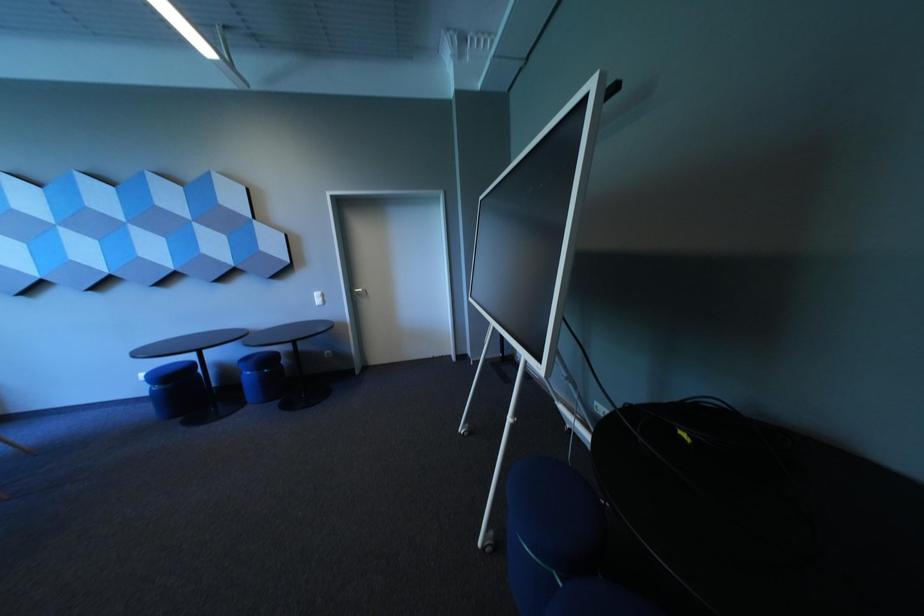
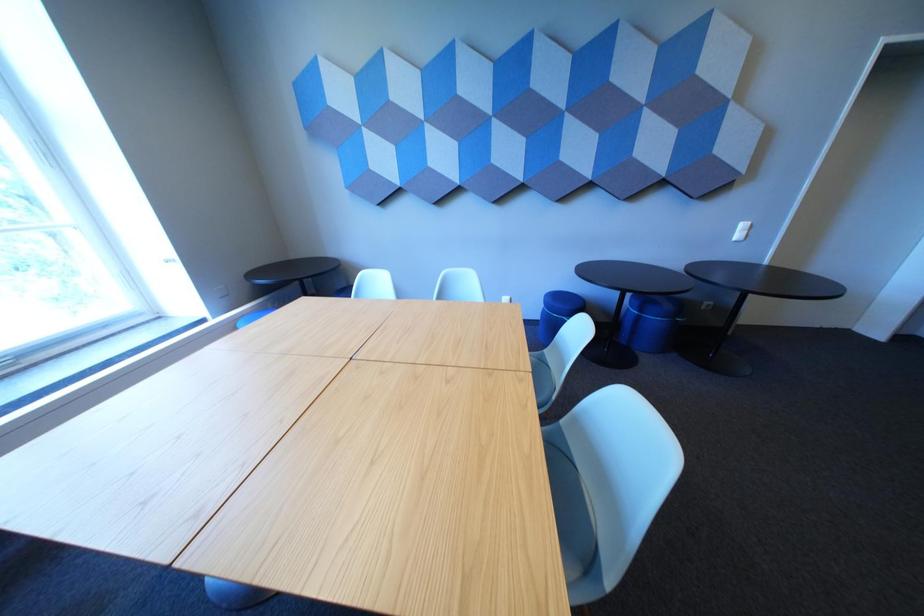
Question: In a continuous first-person perspective shot, in which direction is the camera moving?

Choices:
 (A) Left
 (B) Right
 (C) Forward
 (D) Backward

Answer: (A)